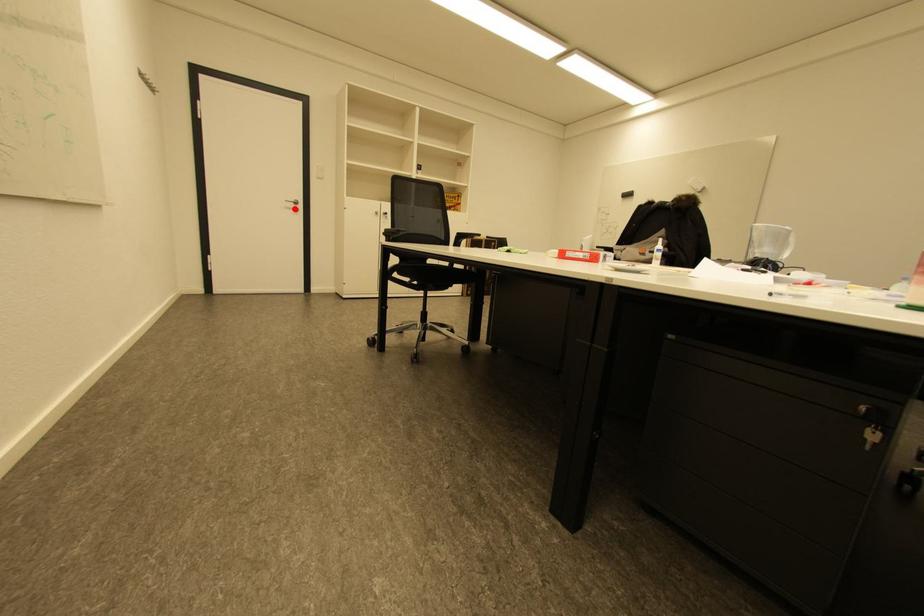
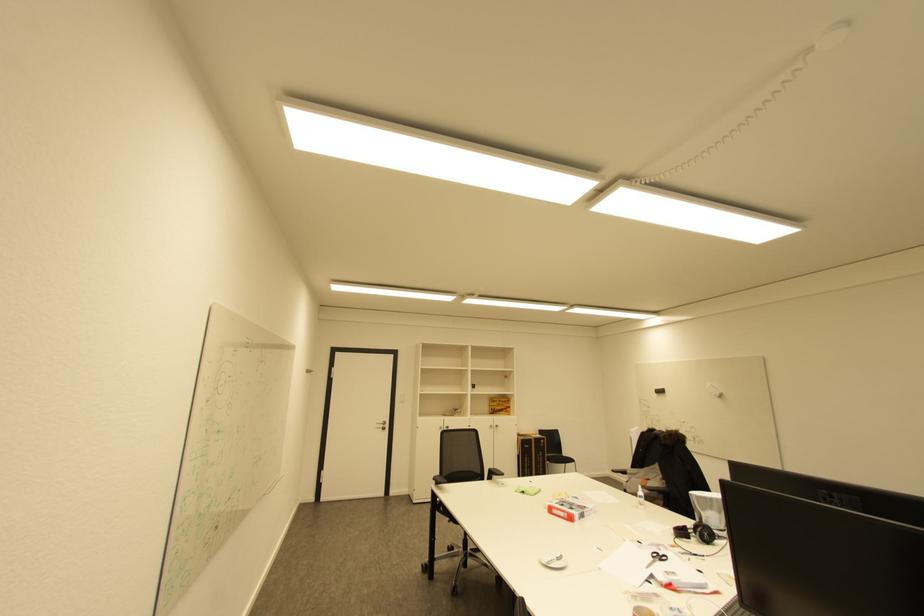
Where in the second image is the point corresponding to the highlighted location from the first image?

(385, 429)